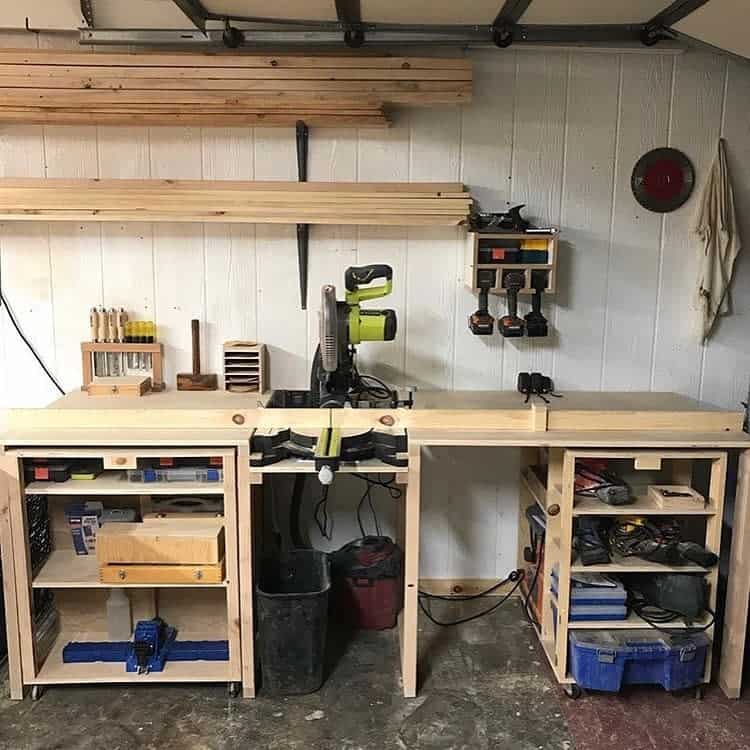
Locate an element on the screen. The image size is (750, 750). work bench is located at coordinates (466, 404).